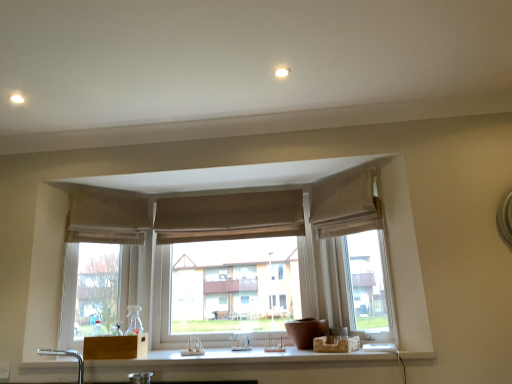
Question: Does brown fabric curtain at center, marked as the 2th curtain in a right-to-left arrangement, come in front of beige fabric curtain at upper center, the 3th curtain in the right-to-left sequence?

Choices:
 (A) no
 (B) yes

Answer: (A)

Question: Considering the relative sizes of brown fabric curtain at center, placed as the 2th curtain when sorted from left to right, and beige fabric curtain at upper center, the 3th curtain in the right-to-left sequence, in the image provided, is brown fabric curtain at center, placed as the 2th curtain when sorted from left to right, taller than beige fabric curtain at upper center, the 3th curtain in the right-to-left sequence,?

Choices:
 (A) yes
 (B) no

Answer: (B)

Question: From a real-world perspective, is brown fabric curtain at center, marked as the 2th curtain in a right-to-left arrangement, physically below beige fabric curtain at upper center, the first curtain in the left-to-right sequence?

Choices:
 (A) no
 (B) yes

Answer: (A)

Question: From the image's perspective, does brown fabric curtain at center, marked as the 2th curtain in a right-to-left arrangement, appear higher than beige fabric curtain at upper center, the first curtain in the left-to-right sequence?

Choices:
 (A) no
 (B) yes

Answer: (B)

Question: Can you confirm if brown fabric curtain at center, marked as the 2th curtain in a right-to-left arrangement, is smaller than beige fabric curtain at upper center, the first curtain in the left-to-right sequence?

Choices:
 (A) no
 (B) yes

Answer: (B)

Question: From the image's perspective, does brown fabric curtain at center, placed as the 2th curtain when sorted from left to right, appear lower than beige fabric curtain at upper center, the 3th curtain in the right-to-left sequence?

Choices:
 (A) no
 (B) yes

Answer: (A)

Question: Does beige fabric curtain at upper right, which ranks as the 1th curtain in right-to-left order, have a larger size compared to beige fabric curtain at upper center, the 3th curtain in the right-to-left sequence?

Choices:
 (A) no
 (B) yes

Answer: (A)

Question: Is beige fabric curtain at upper right, the 3th curtain when ordered from left to right, positioned in front of beige fabric curtain at upper center, the 3th curtain in the right-to-left sequence?

Choices:
 (A) no
 (B) yes

Answer: (B)

Question: Is beige fabric curtain at upper right, the 3th curtain when ordered from left to right, thinner than beige fabric curtain at upper center, the first curtain in the left-to-right sequence?

Choices:
 (A) yes
 (B) no

Answer: (A)

Question: Is beige fabric curtain at upper right, the 3th curtain when ordered from left to right, facing away from beige fabric curtain at upper center, the 3th curtain in the right-to-left sequence?

Choices:
 (A) yes
 (B) no

Answer: (B)

Question: Does beige fabric curtain at upper right, which ranks as the 1th curtain in right-to-left order, lie behind beige fabric curtain at upper center, the 3th curtain in the right-to-left sequence?

Choices:
 (A) no
 (B) yes

Answer: (A)

Question: Is beige fabric curtain at upper right, which ranks as the 1th curtain in right-to-left order, directly adjacent to beige fabric curtain at upper center, the first curtain in the left-to-right sequence?

Choices:
 (A) yes
 (B) no

Answer: (B)

Question: Would you say beige fabric curtain at upper center, the 3th curtain in the right-to-left sequence, is outside brown fabric curtain at center, placed as the 2th curtain when sorted from left to right?

Choices:
 (A) no
 (B) yes

Answer: (B)